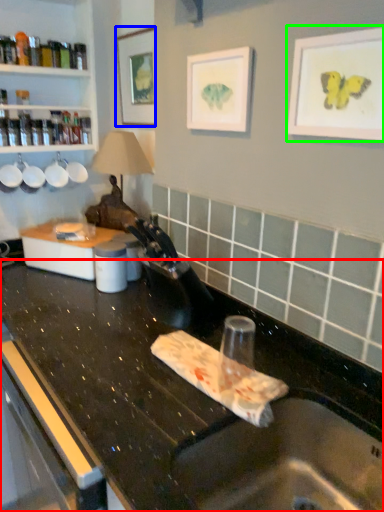
Question: Which object is positioned farthest from countertop (highlighted by a red box)? Select from picture frame (highlighted by a blue box) and picture frame (highlighted by a green box).

Choices:
 (A) picture frame
 (B) picture frame

Answer: (A)